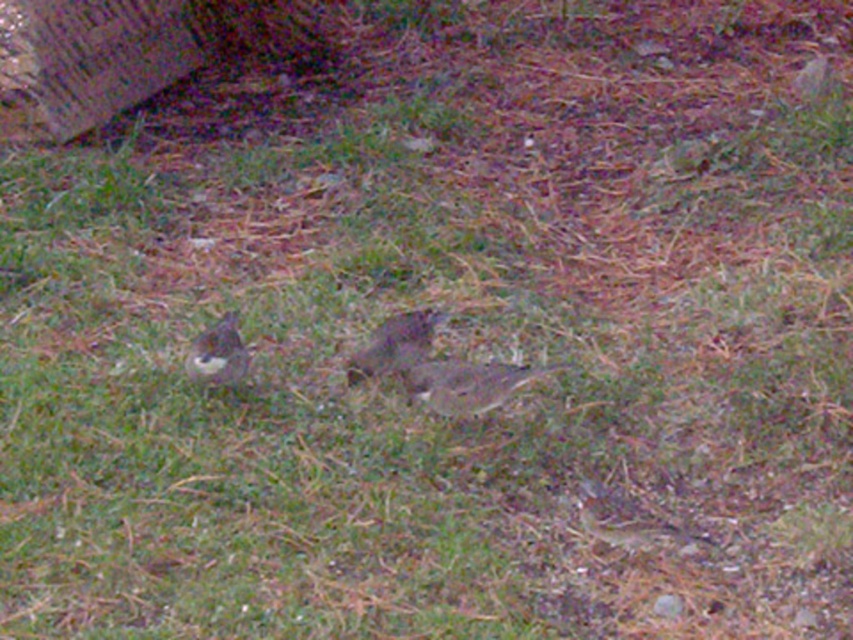
Question: Which object appears closest to the camera in this image?

Choices:
 (A) brown speckled bird at lower left
 (B) brown matte bird at center

Answer: (A)

Question: Which object appears farthest from the camera in this image?

Choices:
 (A) brown feathered bird at center
 (B) brown matte bird at center
 (C) brown speckled bird at lower left

Answer: (B)

Question: Can you confirm if brown matte bird at center is thinner than brown speckled bird at lower left?

Choices:
 (A) no
 (B) yes

Answer: (A)

Question: Considering the real-world distances, which object is closest to the brown speckled bird at lower left?

Choices:
 (A) brown feathered bird at center
 (B) brown matte bird at center

Answer: (B)

Question: Is brown matte bird at center bigger than brown speckled bird at lower left?

Choices:
 (A) no
 (B) yes

Answer: (B)

Question: Can you confirm if brown matte bird at center is thinner than brown speckled bird at lower left?

Choices:
 (A) no
 (B) yes

Answer: (A)